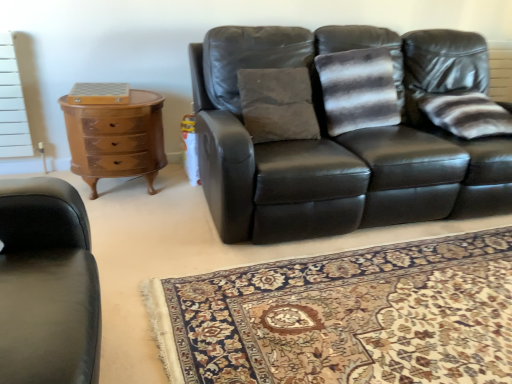
You are a GUI agent. You are given a task and a screenshot of the screen. Output one action in this format:
    pyautogui.click(x=<x>, y=<y>)
    Task: Click on the vacant area that is in front of wooden glossy chest of drawers at left
    This screenshot has width=512, height=384.
    Given the screenshot: What is the action you would take?
    pyautogui.click(x=125, y=214)